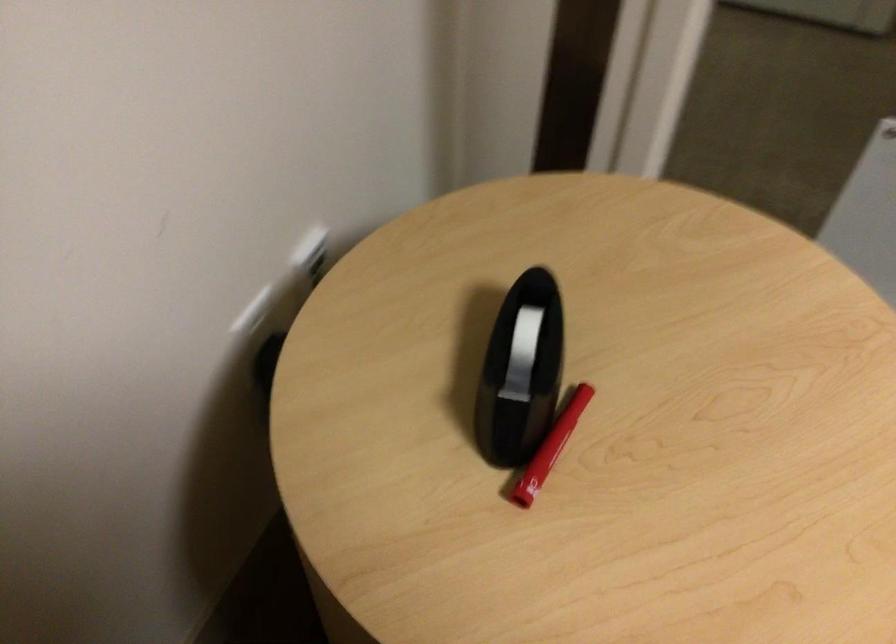
This screenshot has height=644, width=896. I want to click on black tape dispenser, so click(521, 371).